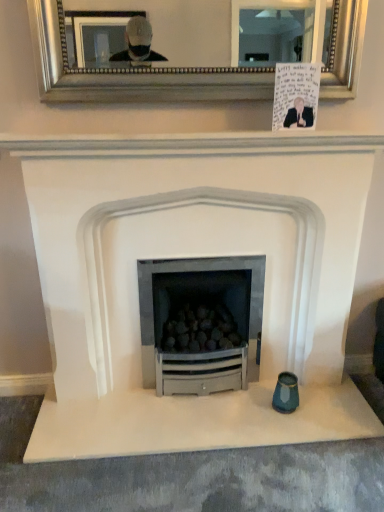
Question: Can we say white matte fireplace at center lies outside silver/golden mirror at upper center?

Choices:
 (A) yes
 (B) no

Answer: (A)

Question: Considering the relative sizes of white matte fireplace at center and silver/golden mirror at upper center in the image provided, is white matte fireplace at center bigger than silver/golden mirror at upper center?

Choices:
 (A) yes
 (B) no

Answer: (A)

Question: Can you confirm if white matte fireplace at center is taller than silver/golden mirror at upper center?

Choices:
 (A) no
 (B) yes

Answer: (B)

Question: Does white matte fireplace at center have a lesser width compared to silver/golden mirror at upper center?

Choices:
 (A) no
 (B) yes

Answer: (A)

Question: Can you confirm if white matte fireplace at center is shorter than silver/golden mirror at upper center?

Choices:
 (A) no
 (B) yes

Answer: (A)

Question: Considering the relative sizes of white matte fireplace at center and silver/golden mirror at upper center in the image provided, is white matte fireplace at center wider than silver/golden mirror at upper center?

Choices:
 (A) yes
 (B) no

Answer: (A)

Question: Is handwritten paper at upper center at the left side of white matte fireplace at center?

Choices:
 (A) yes
 (B) no

Answer: (B)

Question: Would you consider handwritten paper at upper center to be distant from white matte fireplace at center?

Choices:
 (A) no
 (B) yes

Answer: (A)

Question: Is white matte fireplace at center inside handwritten paper at upper center?

Choices:
 (A) yes
 (B) no

Answer: (B)

Question: Is handwritten paper at upper center oriented towards white matte fireplace at center?

Choices:
 (A) yes
 (B) no

Answer: (B)

Question: Does handwritten paper at upper center have a greater width compared to white matte fireplace at center?

Choices:
 (A) no
 (B) yes

Answer: (A)

Question: Is handwritten paper at upper center smaller than white matte fireplace at center?

Choices:
 (A) yes
 (B) no

Answer: (A)

Question: Can you confirm if handwritten paper at upper center is positioned to the left of silver/golden mirror at upper center?

Choices:
 (A) no
 (B) yes

Answer: (A)